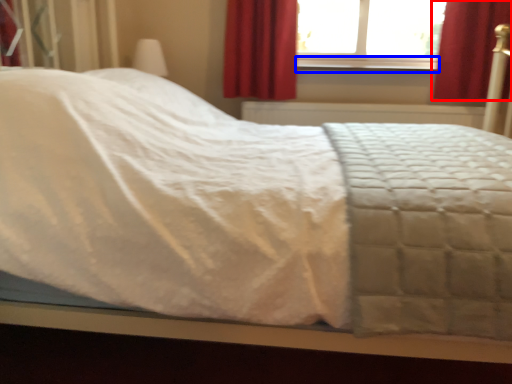
Question: Which point is further to the camera, curtain (highlighted by a red box) or window sill (highlighted by a blue box)?

Choices:
 (A) curtain
 (B) window sill

Answer: (B)